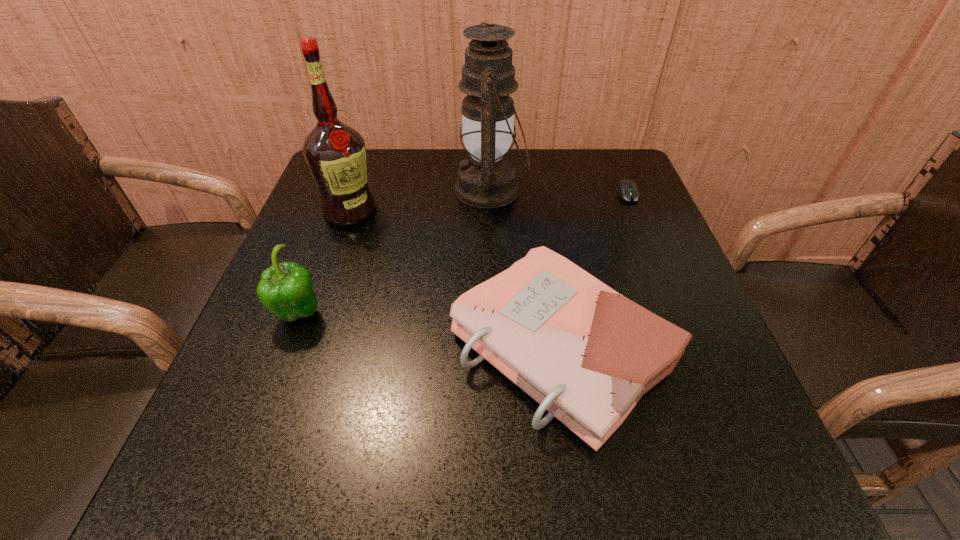
In order to click on free point between the second shortest object and the third tallest object in this screenshot , I will do `click(431, 330)`.

This screenshot has width=960, height=540. Identify the location of free space between the fourth tallest object and the shortest object. (595, 270).

The width and height of the screenshot is (960, 540). What are the coordinates of `vacant space that is in between the oil lamp and the alcohol` in the screenshot? It's located at (420, 200).

Identify the location of free spot between the fourth tallest object and the computer mouse. click(595, 270).

Identify the location of object that is the closest to the third shortest object. Image resolution: width=960 pixels, height=540 pixels. (335, 153).

Find the location of a particular element. object that is the third closest to the alcohol is located at coordinates (587, 354).

The height and width of the screenshot is (540, 960). Identify the location of free space in the image that satisfies the following two spatial constraints: 1. on the label of the fourth tallest object; 2. on the right side of the alcohol. pos(303,347).

The height and width of the screenshot is (540, 960). What are the coordinates of `vacant area in the image that satisfies the following two spatial constraints: 1. on the back side of the oil lamp; 2. on the left side of the bell pepper` in the screenshot? It's located at (347, 190).

I want to click on free spot that satisfies the following two spatial constraints: 1. on the label of the phonebook; 2. on the left side of the alcohol, so click(x=303, y=347).